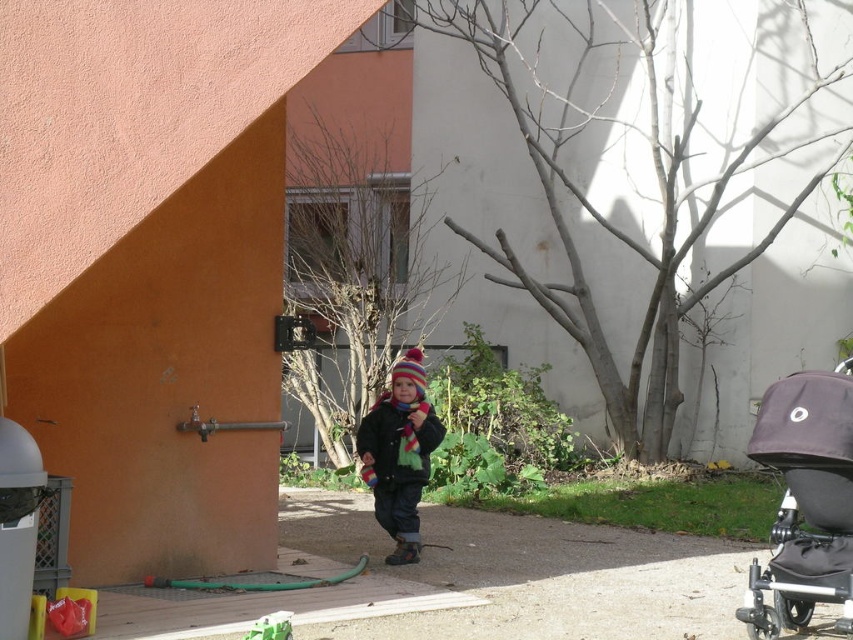
You are a parent carrying a sleeping child and need to place them in the stroller. The stroller is located at point (805, 500). Which direction should you walk to reach the dark gray fabric stroller at lower right?

You should walk towards the lower right direction to reach the dark gray fabric stroller at lower right located at point (805, 500).

You are a parent carrying a toddler and need to place the dark gray fabric stroller at lower right. Where should you position it relative to the striped woolen hat at center?

The dark gray fabric stroller at lower right should be placed below the striped woolen hat at center, as the stroller is positioned below the hat in the scene.